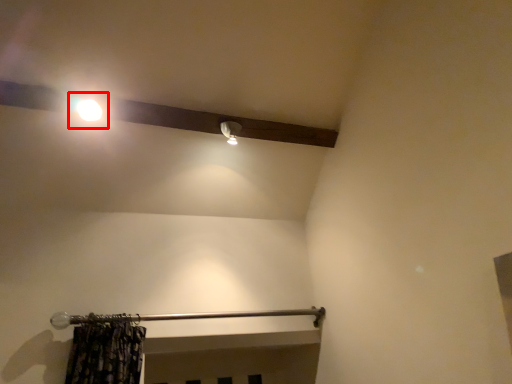
Question: Considering the relative positions of moonlight (annotated by the red box) and rail in the image provided, where is moonlight (annotated by the red box) located with respect to the staircase?

Choices:
 (A) left
 (B) right

Answer: (A)